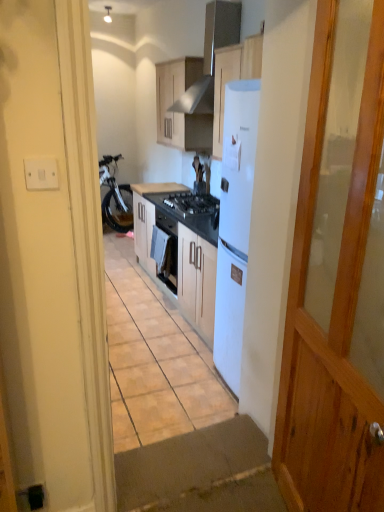
This screenshot has height=512, width=384. I want to click on black matte gas stove at center, so click(192, 203).

Describe the element at coordinates (180, 111) in the screenshot. I see `matte wood cabinet at upper center, marked as the 1th cabinetry in a top-to-bottom arrangement` at that location.

Describe the element at coordinates (211, 56) in the screenshot. This screenshot has width=384, height=512. I see `white glossy refrigerator at upper center` at that location.

The image size is (384, 512). Find the location of `white matte cabinet at center, the second cabinetry viewed from the top`. white matte cabinet at center, the second cabinetry viewed from the top is located at coordinates (148, 220).

In the scene shown: Between white matte cabinet at center, marked as the 1th cabinetry in a bottom-to-top arrangement, and matte wood cabinet at upper center, which is counted as the 2th cabinetry, starting from the bottom, which one appears on the right side from the viewer's perspective?

matte wood cabinet at upper center, which is counted as the 2th cabinetry, starting from the bottom, is more to the right.

Can you confirm if white matte cabinet at center, the second cabinetry viewed from the top, is wider than matte wood cabinet at upper center, which is counted as the 2th cabinetry, starting from the bottom?

Indeed, white matte cabinet at center, the second cabinetry viewed from the top, has a greater width compared to matte wood cabinet at upper center, which is counted as the 2th cabinetry, starting from the bottom.

Identify the location of cabinetry that appears above the white matte cabinet at center, the second cabinetry viewed from the top (from a real-world perspective). The height and width of the screenshot is (512, 384). (180, 111).

Does point (135, 214) come closer to viewer compared to point (180, 95)?

No, (135, 214) is behind (180, 95).

Are white glossy refrigerator at upper center and matte wood cabinet at upper center, marked as the 1th cabinetry in a top-to-bottom arrangement, located far from each other?

No, white glossy refrigerator at upper center is not far from matte wood cabinet at upper center, marked as the 1th cabinetry in a top-to-bottom arrangement.

Which of these two, white glossy refrigerator at upper center or matte wood cabinet at upper center, marked as the 1th cabinetry in a top-to-bottom arrangement, is smaller?

matte wood cabinet at upper center, marked as the 1th cabinetry in a top-to-bottom arrangement.

In the image, is white glossy refrigerator at upper center on the left side or the right side of matte wood cabinet at upper center, which is counted as the 2th cabinetry, starting from the bottom?

white glossy refrigerator at upper center is positioned on matte wood cabinet at upper center, which is counted as the 2th cabinetry, starting from the bottom,'s right side.

Does black matte gas stove at center turn towards matte wood cabinet at upper center, marked as the 1th cabinetry in a top-to-bottom arrangement?

No, black matte gas stove at center is not facing towards matte wood cabinet at upper center, marked as the 1th cabinetry in a top-to-bottom arrangement.

Are black matte gas stove at center and matte wood cabinet at upper center, which is counted as the 2th cabinetry, starting from the bottom, located far from each other?

No, black matte gas stove at center is in close proximity to matte wood cabinet at upper center, which is counted as the 2th cabinetry, starting from the bottom.

Can you confirm if black matte gas stove at center is shorter than matte wood cabinet at upper center, marked as the 1th cabinetry in a top-to-bottom arrangement?

Indeed, black matte gas stove at center has a lesser height compared to matte wood cabinet at upper center, marked as the 1th cabinetry in a top-to-bottom arrangement.

Can you confirm if matte wood cabinet at upper center, which is counted as the 2th cabinetry, starting from the bottom, is thinner than white matte cabinet at center, marked as the 1th cabinetry in a bottom-to-top arrangement?

Yes.

Can white matte cabinet at center, the second cabinetry viewed from the top, be found inside matte wood cabinet at upper center, marked as the 1th cabinetry in a top-to-bottom arrangement?

No.

Measure the distance between white plastic switch at left and white glossy refrigerator at upper center.

They are 9.11 feet apart.

Is white plastic switch at left facing away from white glossy refrigerator at upper center?

white plastic switch at left is not turned away from white glossy refrigerator at upper center.

Is white plastic switch at left behind white glossy refrigerator at upper center?

No, it is in front of white glossy refrigerator at upper center.

Looking at this image, in terms of size, does white plastic switch at left appear bigger or smaller than white glossy refrigerator at upper center?

white plastic switch at left is smaller than white glossy refrigerator at upper center.

Is white glossy refrigerator at upper center in front of or behind white matte cabinet at center, the second cabinetry viewed from the top, in the image?

white glossy refrigerator at upper center is positioned closer to the viewer than white matte cabinet at center, the second cabinetry viewed from the top.

Is white glossy refrigerator at upper center not inside white matte cabinet at center, marked as the 1th cabinetry in a bottom-to-top arrangement?

That's correct, white glossy refrigerator at upper center is outside of white matte cabinet at center, marked as the 1th cabinetry in a bottom-to-top arrangement.

Measure the distance from white glossy refrigerator at upper center to white matte cabinet at center, marked as the 1th cabinetry in a bottom-to-top arrangement.

white glossy refrigerator at upper center is 1.20 meters away from white matte cabinet at center, marked as the 1th cabinetry in a bottom-to-top arrangement.

From a real-world perspective, is white glossy refrigerator at upper center physically below white matte cabinet at center, the second cabinetry viewed from the top?

Actually, white glossy refrigerator at upper center is physically above white matte cabinet at center, the second cabinetry viewed from the top, in the real world.

From the image's perspective, is matte wood cabinet at upper center, which is counted as the 2th cabinetry, starting from the bottom, above or below white glossy refrigerator at upper center?

Clearly, from the image's perspective, matte wood cabinet at upper center, which is counted as the 2th cabinetry, starting from the bottom, is below white glossy refrigerator at upper center.

Based on the photo, between matte wood cabinet at upper center, which is counted as the 2th cabinetry, starting from the bottom, and white glossy refrigerator at upper center, which one is positioned in front?

white glossy refrigerator at upper center is in front.

Would you consider matte wood cabinet at upper center, which is counted as the 2th cabinetry, starting from the bottom, to be distant from white glossy refrigerator at upper center?

No, there isn't a large distance between matte wood cabinet at upper center, which is counted as the 2th cabinetry, starting from the bottom, and white glossy refrigerator at upper center.

Is matte wood cabinet at upper center, which is counted as the 2th cabinetry, starting from the bottom, bigger than white glossy refrigerator at upper center?

No.

Where is `cabinetry in front of the white matte cabinet at center, the second cabinetry viewed from the top`? The width and height of the screenshot is (384, 512). cabinetry in front of the white matte cabinet at center, the second cabinetry viewed from the top is located at coordinates (180, 111).

Find the location of a particular element. This screenshot has height=512, width=384. cabinetry that is the 1st object located behind the white glossy refrigerator at upper center is located at coordinates (180, 111).

When comparing their distances from black matte gas stove at center, does white glossy refrigerator at upper center or white matte cabinet at center, marked as the 1th cabinetry in a bottom-to-top arrangement, seem further?

white glossy refrigerator at upper center.

Based on their spatial positions, is white matte cabinet at center, marked as the 1th cabinetry in a bottom-to-top arrangement, or matte wood cabinet at upper center, marked as the 1th cabinetry in a top-to-bottom arrangement, further from black matte gas stove at center?

matte wood cabinet at upper center, marked as the 1th cabinetry in a top-to-bottom arrangement, lies further to black matte gas stove at center than the other object.

From the image, which object appears to be nearer to white matte cabinet at center, the second cabinetry viewed from the top, black matte gas stove at center or white plastic switch at left?

Answer: black matte gas stove at center lies closer to white matte cabinet at center, the second cabinetry viewed from the top, than the other object.

Looking at the image, which one is located further to white glossy refrigerator at upper center, black matte gas stove at center or white matte cabinet at center, the second cabinetry viewed from the top?

white matte cabinet at center, the second cabinetry viewed from the top, is further to white glossy refrigerator at upper center.

Looking at the image, which one is located further to white matte cabinet at center, the second cabinetry viewed from the top, white plastic switch at left or matte wood cabinet at upper center, which is counted as the 2th cabinetry, starting from the bottom?

white plastic switch at left is further to white matte cabinet at center, the second cabinetry viewed from the top.

Consider the image. Looking at the image, which one is located closer to white glossy refrigerator at upper center, black matte gas stove at center or matte wood cabinet at upper center, which is counted as the 2th cabinetry, starting from the bottom?

Among the two, matte wood cabinet at upper center, which is counted as the 2th cabinetry, starting from the bottom, is located nearer to white glossy refrigerator at upper center.

When comparing their distances from white glossy refrigerator at upper center, does white matte cabinet at center, marked as the 1th cabinetry in a bottom-to-top arrangement, or white plastic switch at left seem further?

white plastic switch at left is further to white glossy refrigerator at upper center.

Which object lies nearer to the anchor point white plastic switch at left, white matte cabinet at center, the second cabinetry viewed from the top, or black matte gas stove at center?

The object closer to white plastic switch at left is black matte gas stove at center.

Locate an element on the screen. Image resolution: width=384 pixels, height=512 pixels. gas stove between white glossy refrigerator at upper center and white matte cabinet at center, the second cabinetry viewed from the top, vertically is located at coordinates (192, 203).

Identify the location of cabinetry between white plastic switch at left and white matte cabinet at center, the second cabinetry viewed from the top, from front to back. (180, 111).

Find the location of a particular element. The image size is (384, 512). gas stove located between white plastic switch at left and matte wood cabinet at upper center, marked as the 1th cabinetry in a top-to-bottom arrangement, in the depth direction is located at coordinates (192, 203).

This screenshot has height=512, width=384. I want to click on cabinetry between white glossy refrigerator at upper center and black matte gas stove at center vertically, so click(x=180, y=111).